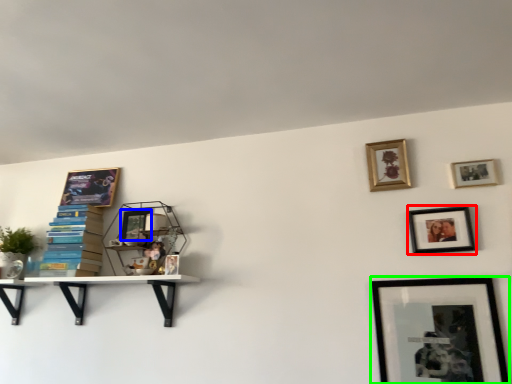
Question: Considering the real-world distances, which object is closest to picture frame (highlighted by a red box)? picture frame (highlighted by a blue box) or picture frame (highlighted by a green box).

Choices:
 (A) picture frame
 (B) picture frame

Answer: (B)